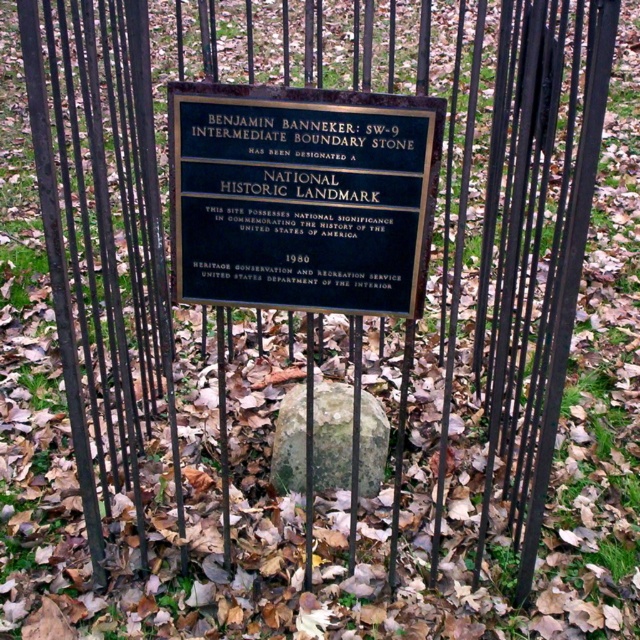
Does gold/black plaque at center appear on the left side of green mossy rock at center?

Correct, you'll find gold/black plaque at center to the left of green mossy rock at center.

From the picture: Is gold/black plaque at center above green mossy rock at center?

Correct, gold/black plaque at center is located above green mossy rock at center.

Does point (404, 236) lie behind point (291, 484)?

No, (404, 236) is in front of (291, 484).

The image size is (640, 640). I want to click on gold/black plaque at center, so click(x=301, y=196).